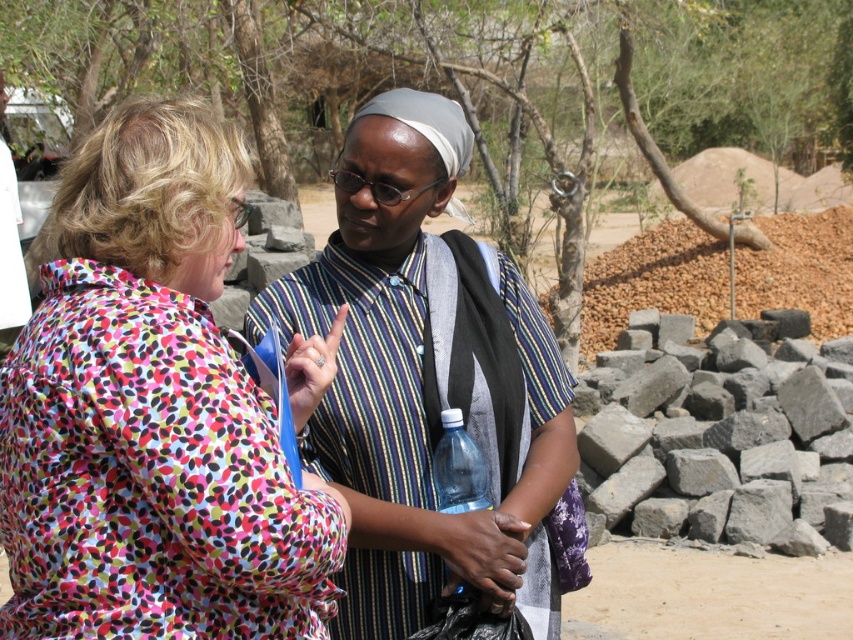
You are organizing a clothing and accessories display. You have a printed fabric blouse at center and a clear plastic bottle at center. If you want to place them side by side on a shelf, which item should be placed first to accommodate their sizes?

The printed fabric blouse at center should be placed first because its width is larger than the clear plastic bottle at center, so it requires more space on the shelf.

Based on the scene description, what object is located at the coordinate point specified as point (151, 412)?

The point (151, 412) corresponds to the printed fabric blouse at center.